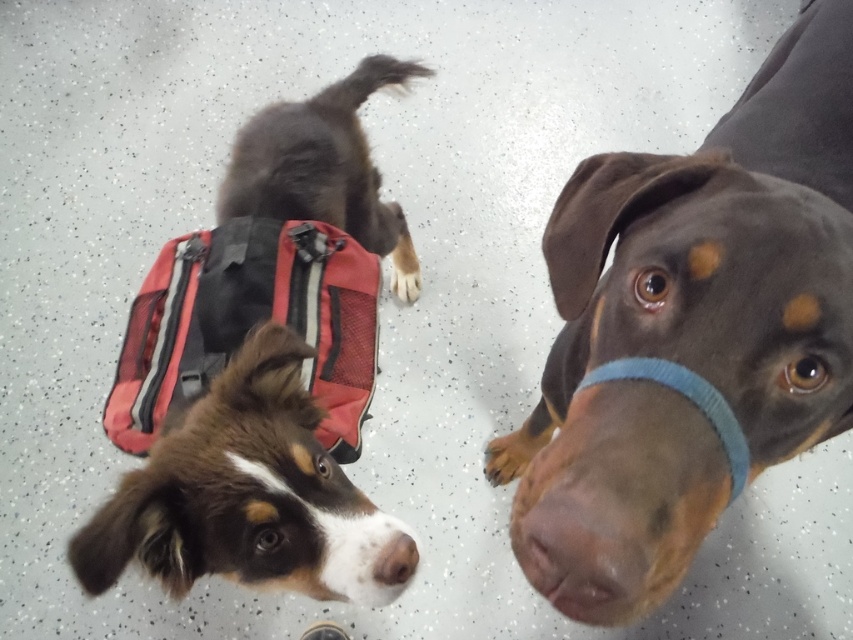
You are a photographer trying to position two items in a frame. You have a brown smooth coat at center and a red mesh bag at upper left. According to the scene, where should you place the red mesh bag relative to the brown smooth coat to match the original image?

The red mesh bag at upper left should be placed to the left of the brown smooth coat at center to match the original image.

You are a photographer setting up a shot. You have a red mesh bag at upper left and a dark brown fur at upper center in your frame. Which object occupies more horizontal space in the image?

The red mesh bag at upper left occupies more horizontal space than the dark brown fur at upper center because its width surpasses the latter.

You are a photographer setting up a shot. You have a camera at eye level and want to ensure both the red mesh bag at upper left and the brown matte nose at lower center are in focus. Given their height difference, which object should you adjust your focus to prioritize first?

The red mesh bag at upper left is taller than the brown matte nose at lower center, so you should prioritize focusing on the red mesh bag at upper left first to ensure both are in focus.